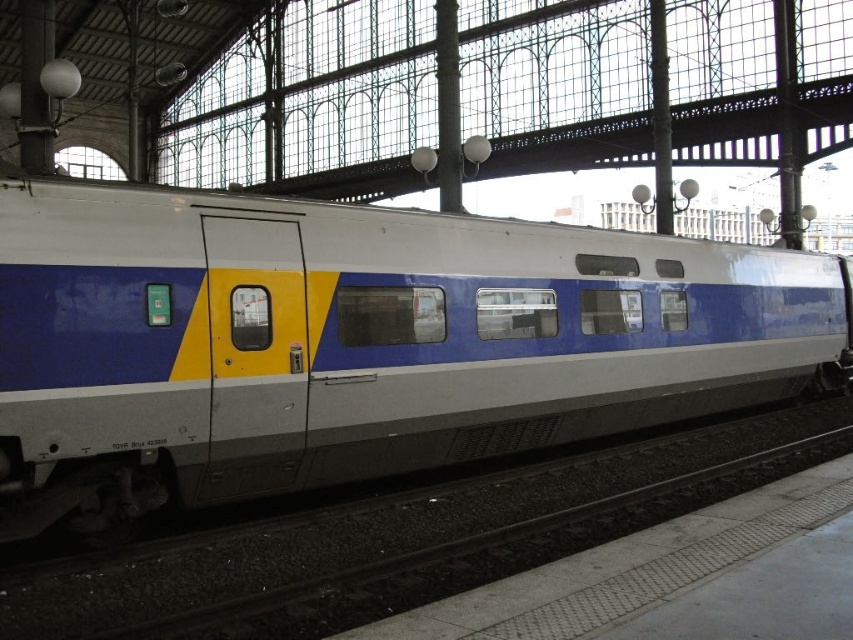
Between matte white train at center and metallic gray track at lower center, which one is positioned lower?

metallic gray track at lower center is below.

Which is in front, point (402, 435) or point (165, 593)?

Point (165, 593)

The height and width of the screenshot is (640, 853). I want to click on matte white train at center, so click(358, 340).